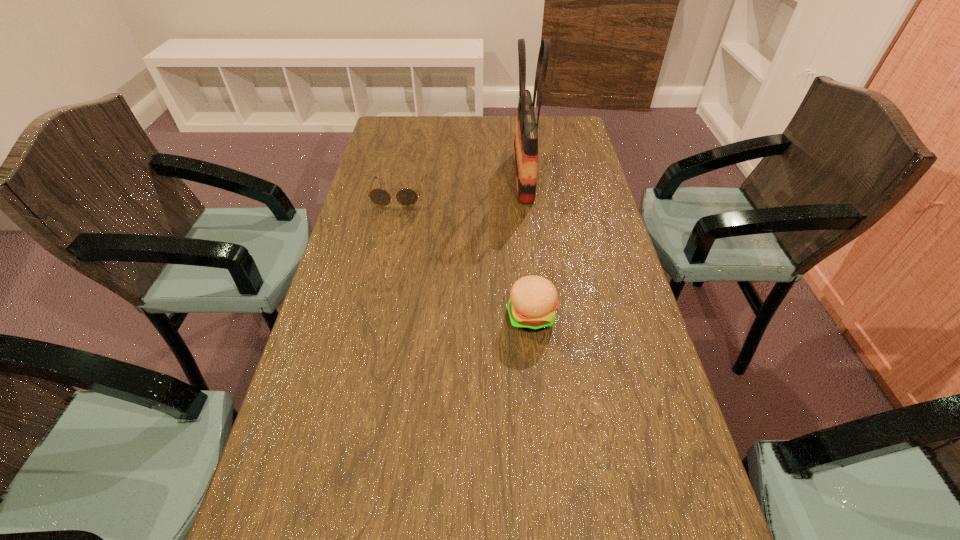
This screenshot has height=540, width=960. Identify the location of the tallest object. click(x=526, y=130).

The image size is (960, 540). In order to click on the second shortest object in this screenshot , I will do `click(533, 300)`.

This screenshot has height=540, width=960. I want to click on hamburger, so click(x=533, y=300).

You are a GUI agent. You are given a task and a screenshot of the screen. Output one action in this format:
    pyautogui.click(x=<x>, y=<y>)
    Task: Click on the shortest object
    This screenshot has width=960, height=540.
    Given the screenshot: What is the action you would take?
    pyautogui.click(x=406, y=197)

The width and height of the screenshot is (960, 540). Find the location of `the leftmost object`. the leftmost object is located at coordinates (406, 197).

The width and height of the screenshot is (960, 540). I want to click on vacant area located on the front-facing side of the shopping bag, so (x=443, y=177).

Locate an element on the screen. This screenshot has width=960, height=540. free location located on the front-facing side of the shopping bag is located at coordinates (486, 177).

Find the location of a particular element. The height and width of the screenshot is (540, 960). free region located 0.210m on the front-facing side of the shopping bag is located at coordinates (445, 177).

At what (x,y) coordinates should I click in order to perform the action: click on free space located on the right of the hamburger. Please return your answer as a coordinate pair (x, y). Image resolution: width=960 pixels, height=540 pixels. Looking at the image, I should click on (637, 316).

This screenshot has width=960, height=540. Identify the location of free location located 0.330m on the lenses of the leftmost object. (376, 289).